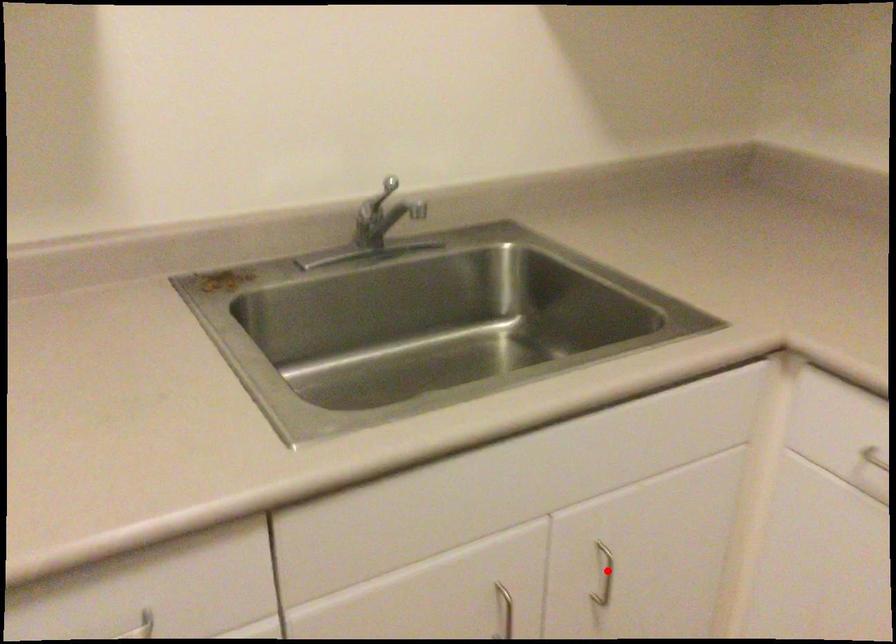
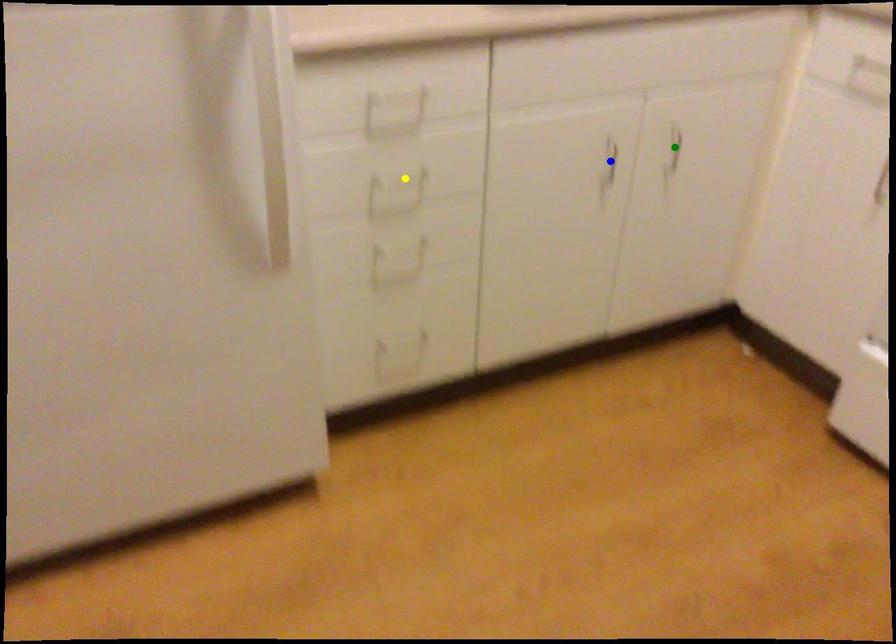
Question: I am providing you with two images of the same scene from different viewpoints. A red point is marked on the first image. You are given multiple points on the second image. In image 2, which mark is for the same physical point as the one in image 1?

Choices:
 (A) blue point
 (B) green point
 (C) yellow point

Answer: (B)